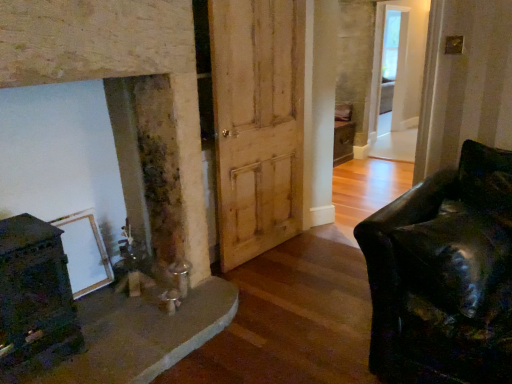
Question: Is clear glass door at upper right wider than natural wood barn door at center?

Choices:
 (A) no
 (B) yes

Answer: (B)

Question: From the image's perspective, is clear glass door at upper right located beneath natural wood barn door at center?

Choices:
 (A) no
 (B) yes

Answer: (A)

Question: Is clear glass door at upper right positioned in front of natural wood barn door at center?

Choices:
 (A) yes
 (B) no

Answer: (B)

Question: Does clear glass door at upper right appear on the right side of natural wood barn door at center?

Choices:
 (A) yes
 (B) no

Answer: (A)

Question: Is clear glass door at upper right outside of natural wood barn door at center?

Choices:
 (A) no
 (B) yes

Answer: (B)

Question: Can you confirm if clear glass door at upper right is positioned to the left of natural wood barn door at center?

Choices:
 (A) yes
 (B) no

Answer: (B)

Question: Are natural wood barn door at center and clear glass door at upper right beside each other?

Choices:
 (A) no
 (B) yes

Answer: (A)

Question: Does natural wood barn door at center have a larger size compared to clear glass door at upper right?

Choices:
 (A) no
 (B) yes

Answer: (A)

Question: Does natural wood barn door at center have a greater width compared to clear glass door at upper right?

Choices:
 (A) no
 (B) yes

Answer: (A)

Question: Is natural wood barn door at center looking in the opposite direction of clear glass door at upper right?

Choices:
 (A) no
 (B) yes

Answer: (A)

Question: Is natural wood barn door at center oriented towards clear glass door at upper right?

Choices:
 (A) no
 (B) yes

Answer: (A)

Question: Considering the relative sizes of natural wood barn door at center and clear glass door at upper right in the image provided, is natural wood barn door at center taller than clear glass door at upper right?

Choices:
 (A) no
 (B) yes

Answer: (A)

Question: In terms of height, does clear glass door at upper right look taller or shorter compared to natural wood barn door at center?

Choices:
 (A) tall
 (B) short

Answer: (A)